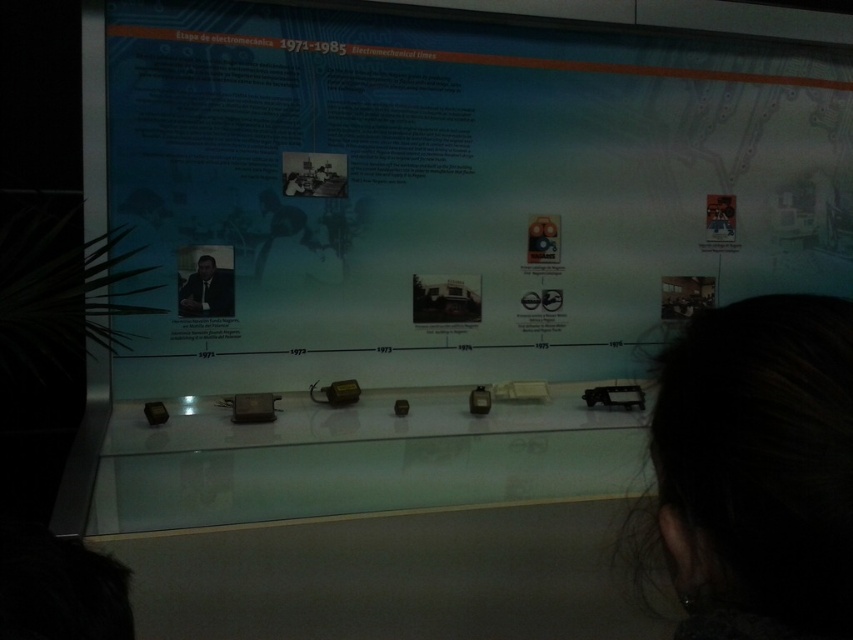
You are a visitor at the museum and want to take a photo of both the matte blue poster at center and the dark brown hair at upper right. Which object should you focus on first if you want to capture both in one frame without moving your camera?

The matte blue poster at center is wider than the dark brown hair at upper right, so you should focus on the matte blue poster at center first to ensure it fits in the frame, then adjust to include the dark brown hair at upper right.

You are a visitor at the museum looking at the exhibit panel about the Electromechanical Times. There are two points on the panel labeled as point 1 at coordinates (685, 118) and point 2 at coordinates (785, 484). Which point is closer to your eyes?

Point 1 at coordinates (685, 118) is closer to your eyes because it is further to the camera than point 2 at coordinates (785, 484).